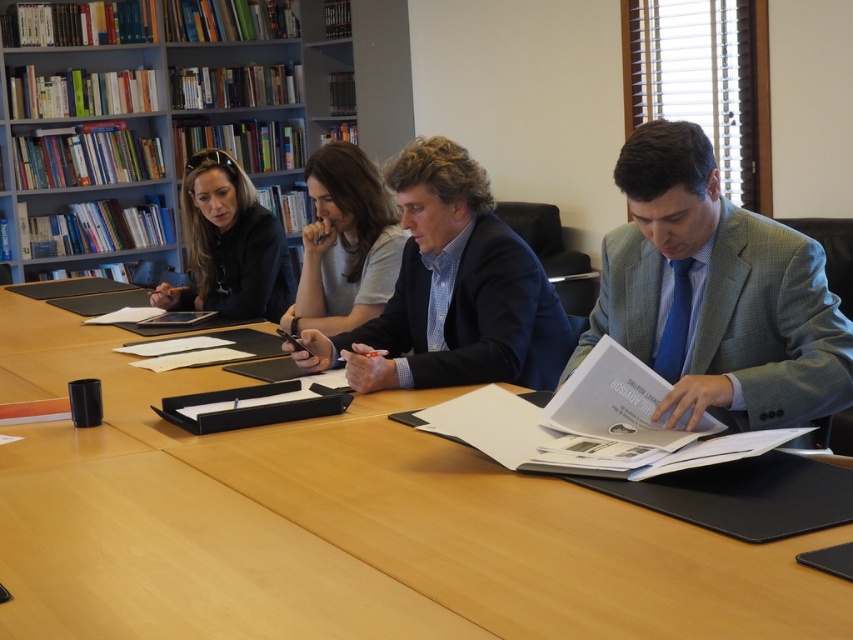
Question: Is the position of matte gray shirt at center less distant than that of matte black tablet at upper left?

Choices:
 (A) no
 (B) yes

Answer: (B)

Question: From the image, what is the correct spatial relationship of wooden table at center in relation to matte black tablet at upper left?

Choices:
 (A) left
 (B) right

Answer: (B)

Question: Can you confirm if wooden bookshelf at upper left is positioned above matte black tablet at upper left?

Choices:
 (A) yes
 (B) no

Answer: (A)

Question: Among these points, which one is farthest from the camera?

Choices:
 (A) (364, 374)
 (B) (200, 122)
 (C) (343, 182)
 (D) (630, 504)

Answer: (B)

Question: Which point appears farthest from the camera in this image?

Choices:
 (A) (642, 257)
 (B) (190, 232)
 (C) (566, 490)

Answer: (B)

Question: Which of the following is the closest to the observer?

Choices:
 (A) dark blue suit at center
 (B) wooden bookshelf at upper left
 (C) matte gray shirt at center

Answer: (A)